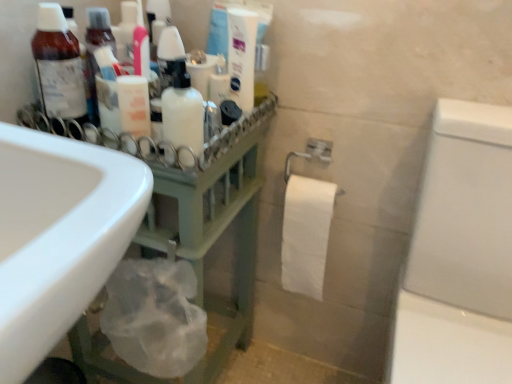
Question: From the image's perspective, is white glossy toothpaste tube at upper center below green matte rack at left?

Choices:
 (A) yes
 (B) no

Answer: (B)

Question: Is white glossy toothpaste tube at upper center at the right side of green matte rack at left?

Choices:
 (A) yes
 (B) no

Answer: (A)

Question: Considering the relative sizes of white glossy toothpaste tube at upper center and green matte rack at left in the image provided, is white glossy toothpaste tube at upper center shorter than green matte rack at left?

Choices:
 (A) no
 (B) yes

Answer: (B)

Question: Is white glossy toothpaste tube at upper center wider than green matte rack at left?

Choices:
 (A) no
 (B) yes

Answer: (A)

Question: Is white glossy toothpaste tube at upper center outside green matte rack at left?

Choices:
 (A) no
 (B) yes

Answer: (B)

Question: In terms of height, does white glossy toothpaste tube at upper center look taller or shorter compared to white matte bottle at center?

Choices:
 (A) short
 (B) tall

Answer: (B)

Question: In the image, is white glossy toothpaste tube at upper center positioned in front of or behind white matte bottle at center?

Choices:
 (A) behind
 (B) front

Answer: (A)

Question: Does point (226, 13) appear closer or farther from the camera than point (166, 94)?

Choices:
 (A) closer
 (B) farther

Answer: (B)

Question: Is white glossy toothpaste tube at upper center inside the boundaries of white matte bottle at center, or outside?

Choices:
 (A) inside
 (B) outside

Answer: (B)

Question: In terms of height, does white glossy toilet at right look taller or shorter compared to white matte lotion at center?

Choices:
 (A) tall
 (B) short

Answer: (A)

Question: Considering the positions of point (458, 162) and point (130, 84), is point (458, 162) closer or farther from the camera than point (130, 84)?

Choices:
 (A) closer
 (B) farther

Answer: (B)

Question: Is white glossy toilet at right to the left or to the right of white matte lotion at center in the image?

Choices:
 (A) right
 (B) left

Answer: (A)

Question: From a real-world perspective, is white glossy toilet at right positioned above or below white matte lotion at center?

Choices:
 (A) below
 (B) above

Answer: (A)

Question: Which is correct: matte brown bottle at left is inside white glossy toothpaste tube at upper center, or outside of it?

Choices:
 (A) inside
 (B) outside

Answer: (B)

Question: Would you say matte brown bottle at left is to the left or to the right of white glossy toothpaste tube at upper center in the picture?

Choices:
 (A) left
 (B) right

Answer: (A)